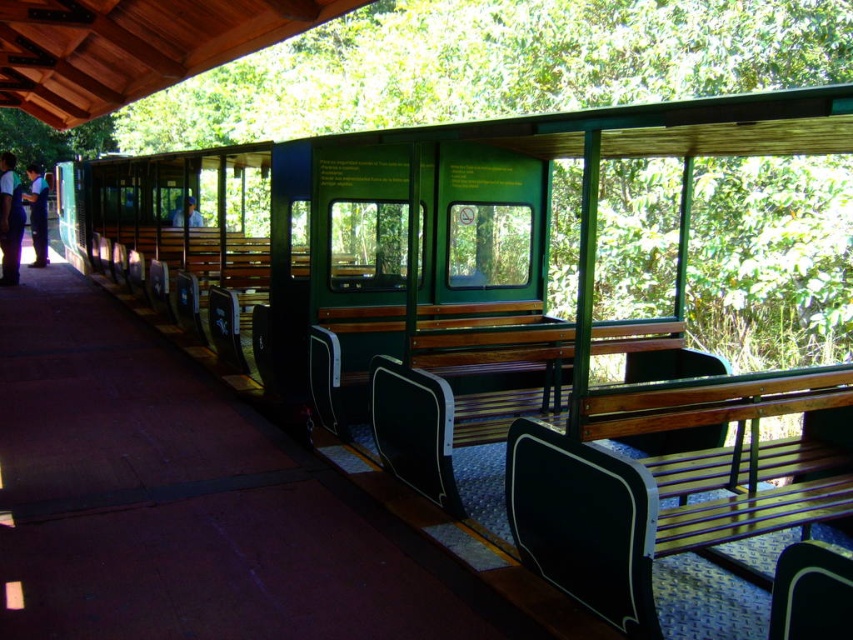
Question: Which object is the closest to the black fabric shirt at left?

Choices:
 (A) black plastic chair at lower right
 (B) dark blue uniform at left
 (C) green matte bench at center
 (D) matte blue shirt at center

Answer: (B)

Question: Which point is farther to the camera?

Choices:
 (A) (45, 212)
 (B) (173, 211)

Answer: (A)

Question: Is black plastic chair at lower right below dark blue uniform at left?

Choices:
 (A) yes
 (B) no

Answer: (A)

Question: Which of the following is the closest to the observer?

Choices:
 (A) (181, 221)
 (B) (822, 580)

Answer: (B)

Question: Does green matte bench at center have a smaller size compared to black plastic chair at lower right?

Choices:
 (A) yes
 (B) no

Answer: (B)

Question: Is black plastic chair at lower right in front of dark blue uniform at left?

Choices:
 (A) no
 (B) yes

Answer: (B)